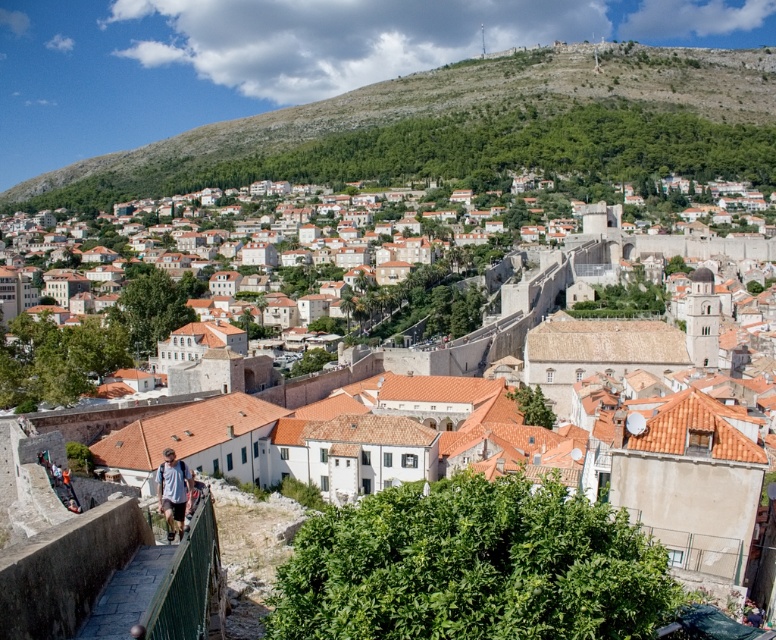
Question: Which of the following is the farthest from the observer?

Choices:
 (A) green textured hillside at upper center
 (B) white stone town at center

Answer: (A)

Question: Can you confirm if green textured hillside at upper center is positioned to the right of white stone town at center?

Choices:
 (A) yes
 (B) no

Answer: (B)

Question: Which is farther from the light blue denim jeans at lower left?

Choices:
 (A) green textured hillside at upper center
 (B) white stone town at center

Answer: (A)

Question: Can you confirm if green textured hillside at upper center is positioned below light blue denim jeans at lower left?

Choices:
 (A) no
 (B) yes

Answer: (A)

Question: Does green textured hillside at upper center appear on the right side of light blue denim jeans at lower left?

Choices:
 (A) yes
 (B) no

Answer: (A)

Question: Considering the real-world distances, which object is closest to the light blue denim jeans at lower left?

Choices:
 (A) green textured hillside at upper center
 (B) white stone town at center

Answer: (B)